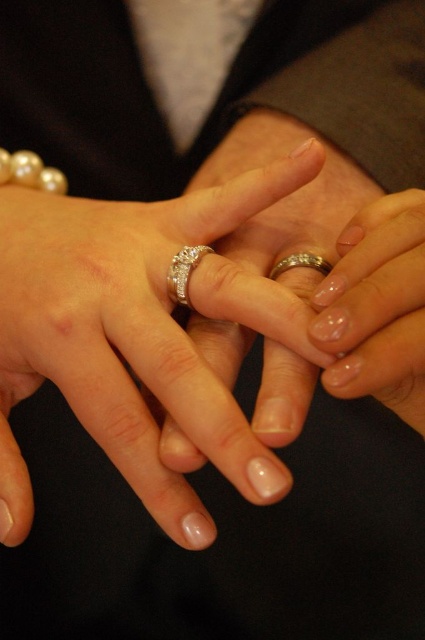
Question: Which point is closer to the camera?

Choices:
 (A) (150, 346)
 (B) (376, 387)
 (C) (184, 291)
 (D) (306, 252)

Answer: (B)

Question: Among these points, which one is farthest from the camera?

Choices:
 (A) (295, 316)
 (B) (181, 273)

Answer: (B)

Question: Is clear acrylic nails at center bigger than gold shiny band at center?

Choices:
 (A) yes
 (B) no

Answer: (A)

Question: Is matte silver ring at center to the right of diamond encrusted ring at center from the viewer's perspective?

Choices:
 (A) no
 (B) yes

Answer: (A)

Question: Is matte silver ring at center thinner than diamond encrusted ring at center?

Choices:
 (A) yes
 (B) no

Answer: (B)

Question: Which object is positioned farthest from the diamond encrusted ring at center?

Choices:
 (A) matte silver ring at center
 (B) gold shiny band at center

Answer: (A)